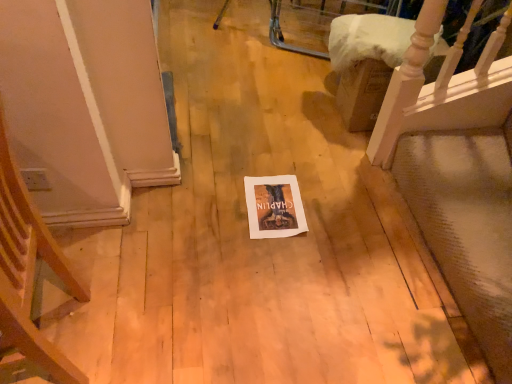
Question: From a real-world perspective, is wooden armchair at left physically below white paper at center?

Choices:
 (A) yes
 (B) no

Answer: (B)

Question: Is wooden armchair at left thinner than white paper at center?

Choices:
 (A) no
 (B) yes

Answer: (A)

Question: Is wooden armchair at left not inside white paper at center?

Choices:
 (A) yes
 (B) no

Answer: (A)

Question: Could white paper at center be considered to be inside wooden armchair at left?

Choices:
 (A) no
 (B) yes

Answer: (A)

Question: Can you confirm if wooden armchair at left is bigger than white paper at center?

Choices:
 (A) no
 (B) yes

Answer: (B)

Question: In terms of size, does white paper at center appear bigger or smaller than wooden staircase at upper right?

Choices:
 (A) big
 (B) small

Answer: (B)

Question: From the image's perspective, is white paper at center above or below wooden staircase at upper right?

Choices:
 (A) below
 (B) above

Answer: (A)

Question: Would you say white paper at center is to the left or to the right of wooden staircase at upper right in the picture?

Choices:
 (A) left
 (B) right

Answer: (A)

Question: In terms of width, does white paper at center look wider or thinner when compared to wooden staircase at upper right?

Choices:
 (A) wide
 (B) thin

Answer: (B)

Question: Would you say wooden staircase at upper right is inside or outside wooden armchair at left?

Choices:
 (A) outside
 (B) inside

Answer: (A)

Question: Considering their positions, is wooden staircase at upper right located in front of or behind wooden armchair at left?

Choices:
 (A) behind
 (B) front

Answer: (A)

Question: Looking at their shapes, would you say wooden staircase at upper right is wider or thinner than wooden armchair at left?

Choices:
 (A) thin
 (B) wide

Answer: (A)

Question: From the image's perspective, relative to wooden armchair at left, is wooden staircase at upper right above or below?

Choices:
 (A) above
 (B) below

Answer: (A)

Question: From a real-world perspective, is wooden armchair at left above or below wooden staircase at upper right?

Choices:
 (A) below
 (B) above

Answer: (B)

Question: In terms of size, does wooden armchair at left appear bigger or smaller than wooden staircase at upper right?

Choices:
 (A) small
 (B) big

Answer: (B)